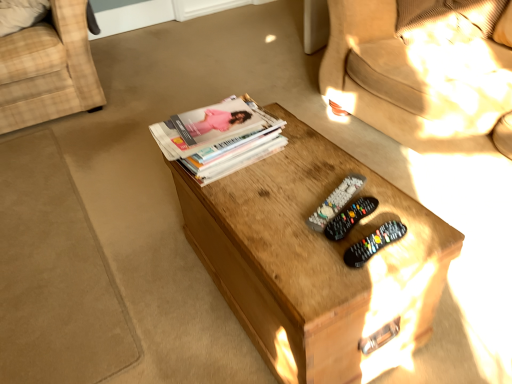
Locate an element on the screen. This screenshot has width=512, height=384. vacant area that is situated to the right of black plastic remote control at center, the 2th remote control positioned from the front is located at coordinates (410, 217).